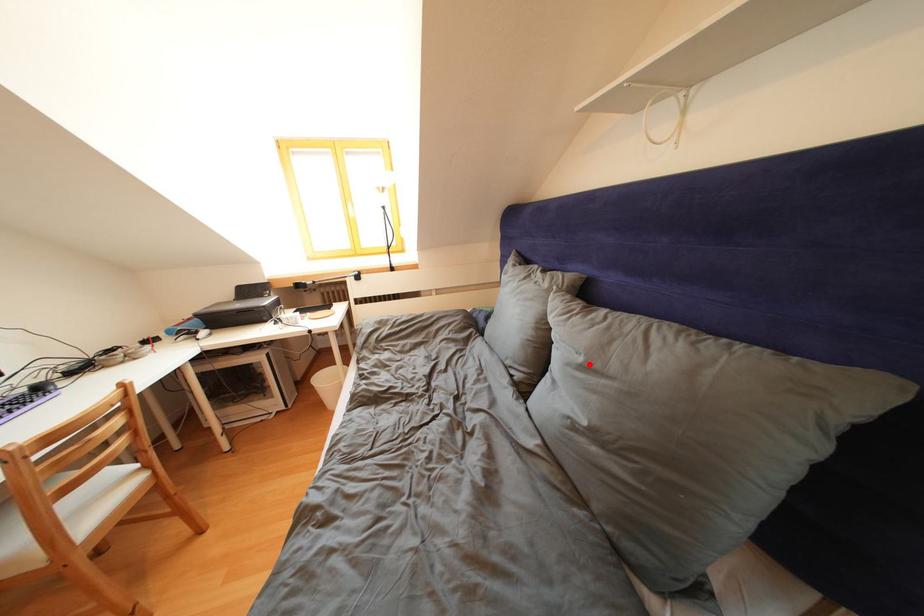
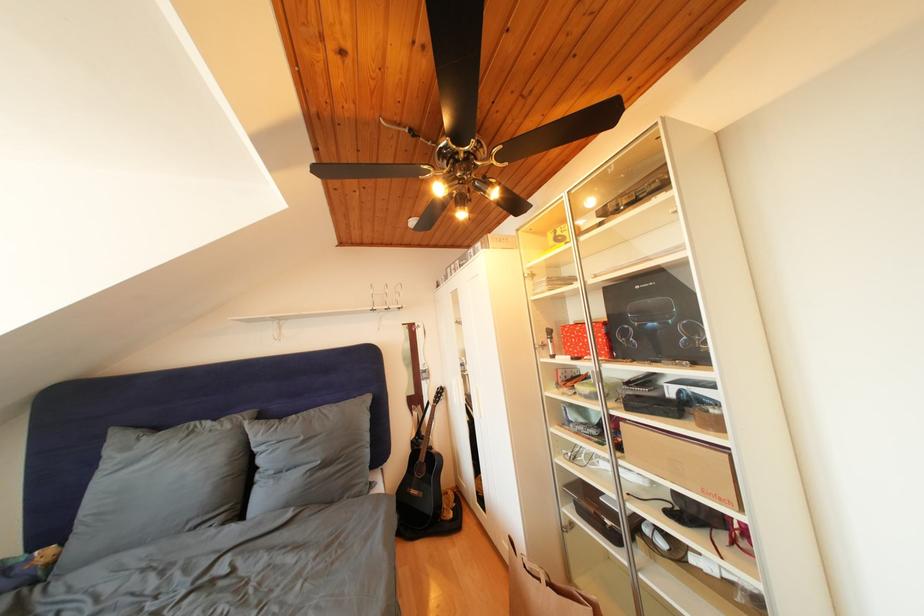
Find the pixel in the second image that matches the highlighted location in the first image.

(310, 444)